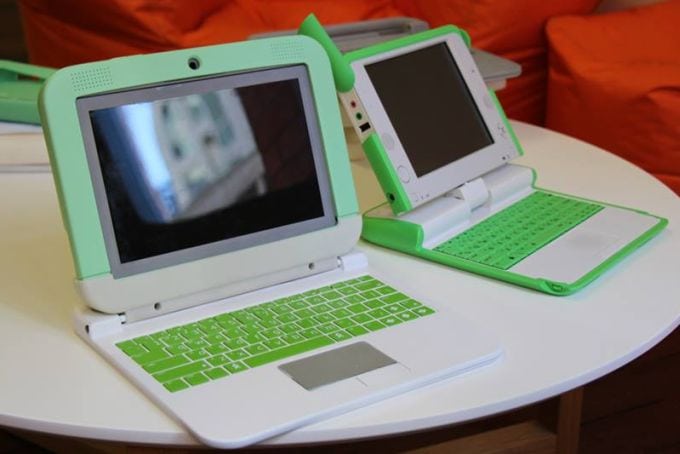
Where is `space to right of toy laptop`? This screenshot has height=454, width=680. space to right of toy laptop is located at coordinates (443, 305), (598, 198).